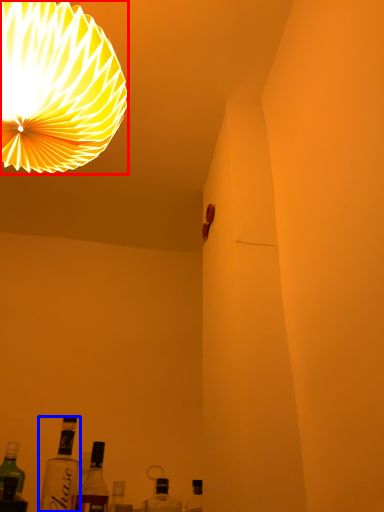
Question: Among these objects, which one is farthest to the camera, lamp (highlighted by a red box) or bottle (highlighted by a blue box)?

Choices:
 (A) lamp
 (B) bottle

Answer: (B)